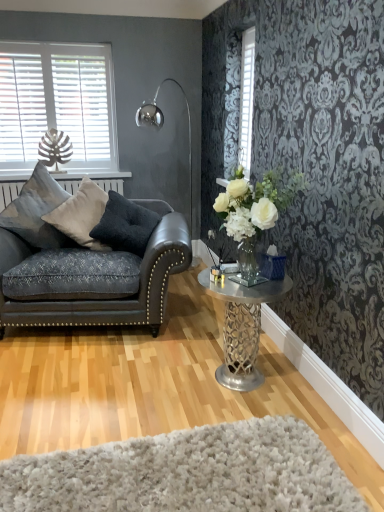
Question: From a real-world perspective, is white glass vase at center right located higher than metallic silver table at center?

Choices:
 (A) yes
 (B) no

Answer: (A)

Question: Is white glass vase at center right shorter than metallic silver table at center?

Choices:
 (A) yes
 (B) no

Answer: (A)

Question: Are white glass vase at center right and metallic silver table at center far apart?

Choices:
 (A) no
 (B) yes

Answer: (A)

Question: Considering the relative sizes of white glass vase at center right and metallic silver table at center in the image provided, is white glass vase at center right thinner than metallic silver table at center?

Choices:
 (A) yes
 (B) no

Answer: (A)

Question: Is white glass vase at center right closer to the viewer compared to metallic silver table at center?

Choices:
 (A) yes
 (B) no

Answer: (A)

Question: Is white glass vase at center right at the right side of metallic silver table at center?

Choices:
 (A) no
 (B) yes

Answer: (B)

Question: Is white shaggy rug at lower center far away from dark gray leather couch at left?

Choices:
 (A) no
 (B) yes

Answer: (B)

Question: From a real-world perspective, is white shaggy rug at lower center under dark gray leather couch at left?

Choices:
 (A) no
 (B) yes

Answer: (B)

Question: Does white shaggy rug at lower center have a greater height compared to dark gray leather couch at left?

Choices:
 (A) no
 (B) yes

Answer: (A)

Question: Considering the relative positions of white shaggy rug at lower center and dark gray leather couch at left in the image provided, is white shaggy rug at lower center to the right of dark gray leather couch at left from the viewer's perspective?

Choices:
 (A) yes
 (B) no

Answer: (A)

Question: From the image's perspective, is white shaggy rug at lower center on dark gray leather couch at left?

Choices:
 (A) no
 (B) yes

Answer: (A)

Question: From the image's perspective, is white shaggy rug at lower center beneath dark gray leather couch at left?

Choices:
 (A) no
 (B) yes

Answer: (B)

Question: Is metallic silver table at center smaller than dark gray velvet pillow at left, marked as the 3th pillow in a left-to-right arrangement?

Choices:
 (A) yes
 (B) no

Answer: (B)